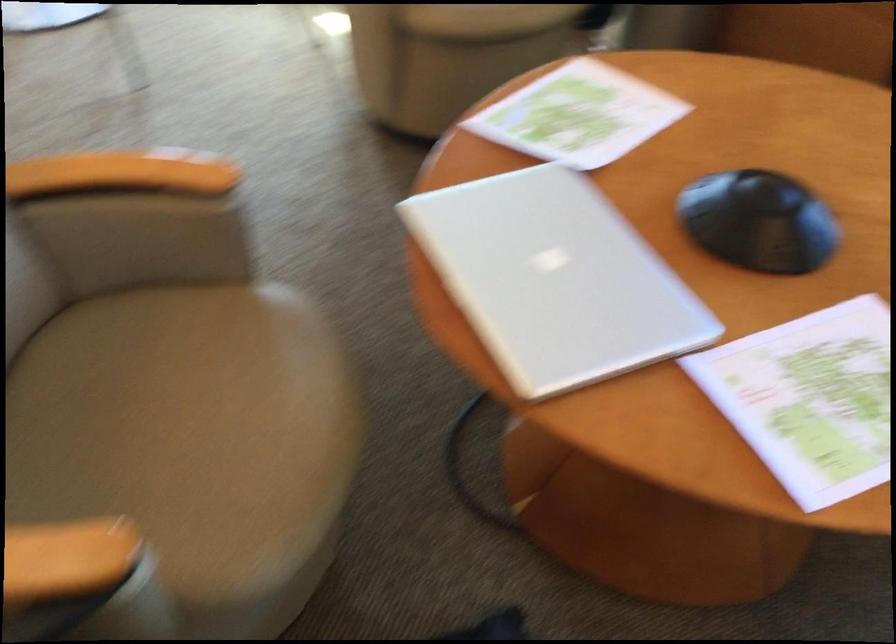
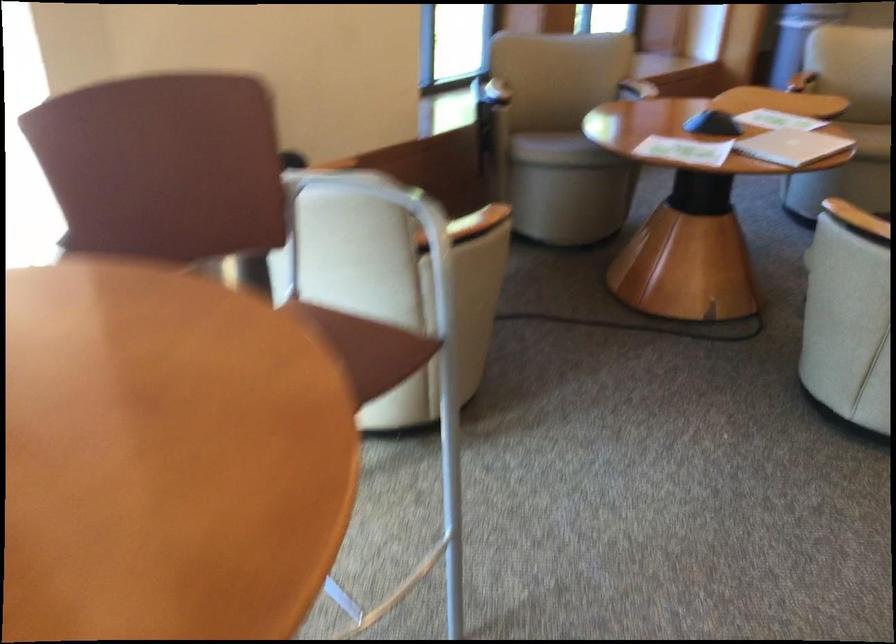
The point at (135,174) is marked in the first image. Where is the corresponding point in the second image?

(857, 220)